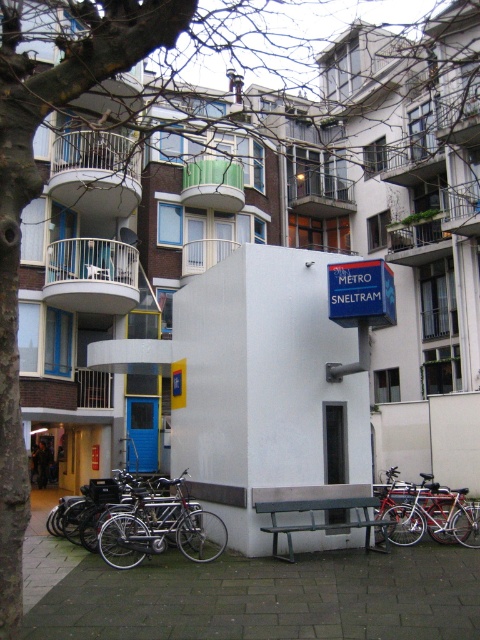
You are standing at the bus stop structure and want to know which of the two points, point (130,529) or point (444,524), is closer to you. Based on the scene description, can you determine which point is nearer?

Point (130,529) is closer to the viewer than point (444,524).

You are standing at the bus stop structure in the image and want to check if the silver metallic bicycle at lower center is within a 10 meter safety zone. Can you confirm if it is?

The silver metallic bicycle at lower center is 9.77 meters from camera, so yes, it is within the 10 meter safety zone.